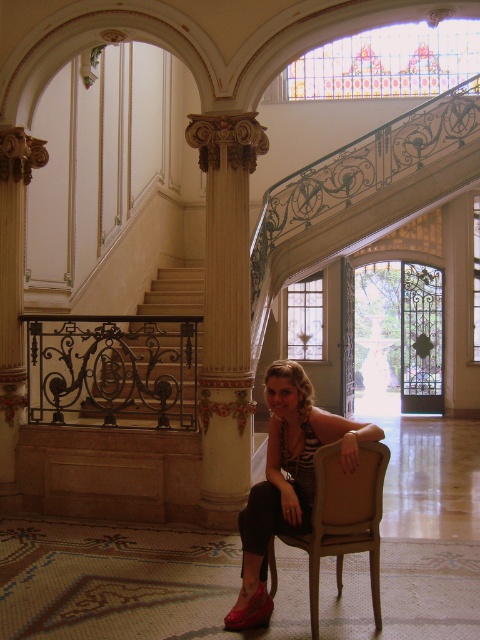
You are standing at the entrance of the building and want to reach the staircase. There is a white marble column at left in your way. Can you walk around it to get to the staircase?

The white marble column at left is positioned at point (12, 275), so yes, you can walk around it to reach the staircase.

You are an interior designer who needs to place a new rug in the area where the matte black dress at center and shiny red shoe at lower center are located. Based on their positions, where should the rug be placed to cover both items?

→ The rug should be placed so that it covers the area where both the matte black dress at center and the shiny red shoe at lower center are located, with the shiny red shoe at lower center positioned to the left of the matte black dress at center.